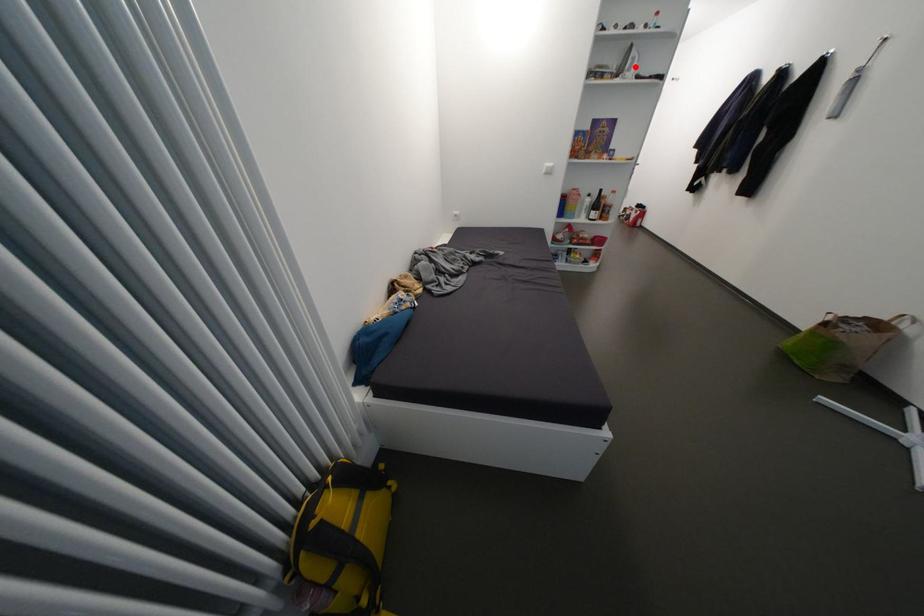
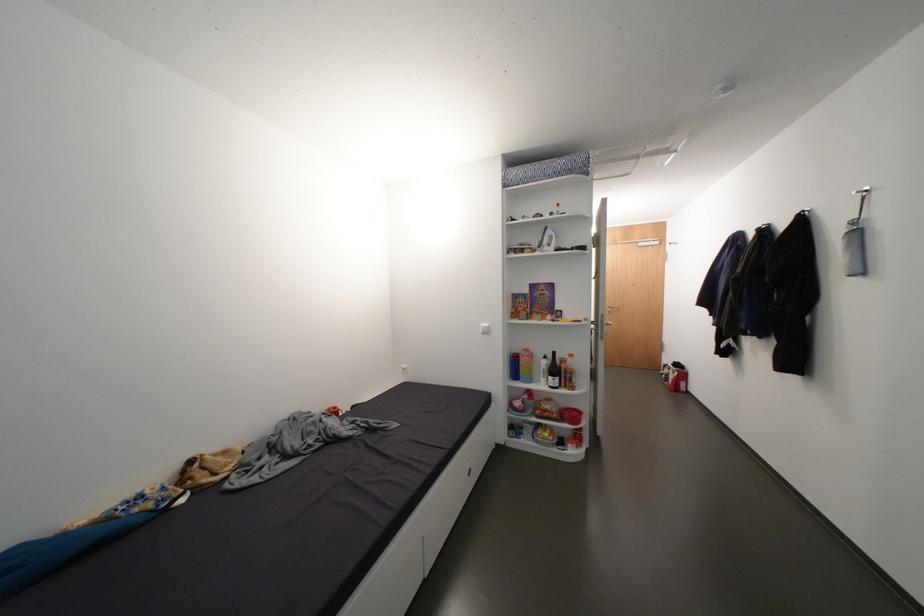
Where in the second image is the point corresponding to the highlighted location from the first image?

(553, 243)